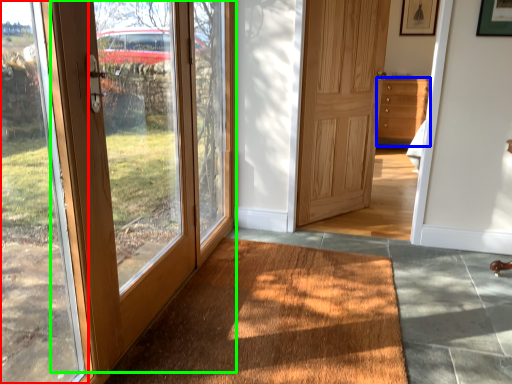
Question: Considering the real-world distances, which object is closest to window frame (highlighted by a red box)? chest of drawers (highlighted by a blue box) or door (highlighted by a green box).

Choices:
 (A) chest of drawers
 (B) door

Answer: (B)